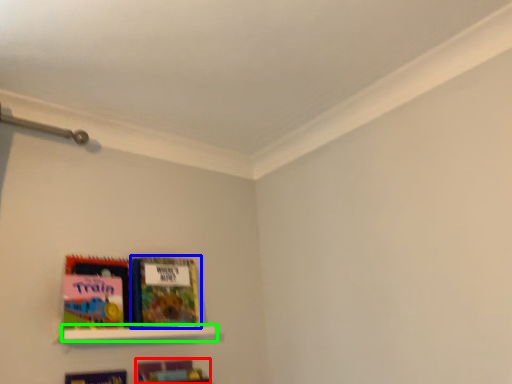
Question: Estimate the real-world distances between objects in this image. Which object is closer to book (highlighted by a red box), book (highlighted by a blue box) or shelf (highlighted by a green box)?

Choices:
 (A) book
 (B) shelf

Answer: (B)